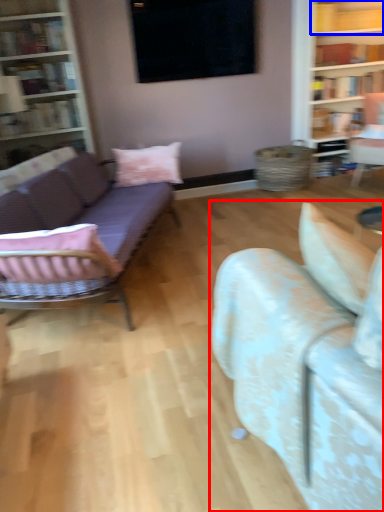
Question: Which object appears closest to the camera in this image, studio couch (highlighted by a red box) or shelf (highlighted by a blue box)?

Choices:
 (A) studio couch
 (B) shelf

Answer: (A)